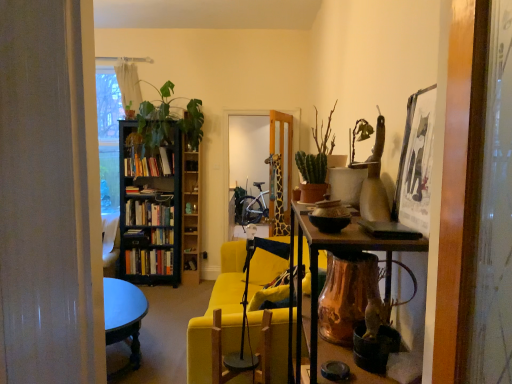
Locate an element on the screen. hardcover book at center, placed as the third book when sorted from top to bottom is located at coordinates (134, 234).

The image size is (512, 384). What do you see at coordinates (148, 213) in the screenshot? I see `hardcover books at left, which is counted as the 2th book, starting from the top` at bounding box center [148, 213].

Measure the distance between point [133,252] and camera.

The distance of point [133,252] from camera is 4.83 meters.

The height and width of the screenshot is (384, 512). Describe the element at coordinates (416, 162) in the screenshot. I see `white paper picture frame at upper right` at that location.

In order to face wooden swivel chair at center, should I rotate leftwards or rightwards?

You should rotate left by 1.893 degrees.

You are a GUI agent. You are given a task and a screenshot of the screen. Output one action in this format:
    pyautogui.click(x=<x>, y=<y>)
    Task: Click on the wooden swivel chair at center
    The height and width of the screenshot is (384, 512).
    Given the screenshot: What is the action you would take?
    pyautogui.click(x=255, y=355)

Where is `green matte cactus at center`? Image resolution: width=512 pixels, height=384 pixels. green matte cactus at center is located at coordinates (316, 163).

Describe the element at coordinates (168, 119) in the screenshot. I see `green leafy plant at left` at that location.

Measure the distance between green leafy plant at left and camera.

green leafy plant at left is 4.47 meters from camera.

At what (x,y) coordinates should I click in order to perform the action: click on hardcover book at center, placed as the third book when sorted from top to bottom. Please return your answer as a coordinate pair (x, y). Looking at the image, I should click on (134, 234).

Are hardcover books at left, which is counted as the 2th book, starting from the top, and green leafy plant at left located far from each other?

No.

From a real-world perspective, does hardcover books at left, placed as the 3th book when sorted from bottom to top, sit lower than green leafy plant at left?

Yes, from a real-world perspective, hardcover books at left, placed as the 3th book when sorted from bottom to top, is under green leafy plant at left.

Does point (145, 204) come in front of point (153, 113)?

No, it is not.

Which is more to the left, hardcover books at left, which is counted as the 2th book, starting from the top, or green leafy plant at left?

From the viewer's perspective, hardcover books at left, which is counted as the 2th book, starting from the top, appears more on the left side.

Between wooden swivel chair at center and yellow fabric couch at center, which one has larger size?

With larger size is yellow fabric couch at center.

Locate an element on the screen. chair behind the wooden swivel chair at center is located at coordinates (222, 314).

Is wooden swivel chair at center facing towards yellow fabric couch at center?

No, wooden swivel chair at center is not oriented towards yellow fabric couch at center.

Based on the photo, from a real-world perspective, is wooden swivel chair at center physically above yellow fabric couch at center?

Yes, from a real-world perspective, wooden swivel chair at center is above yellow fabric couch at center.

From a real-world perspective, between hardcover books at left, which is counted as the first book, starting from the bottom, and wooden shelf at left, who is vertically higher?

From a 3D spatial view, wooden shelf at left is above.

Where is `the 3rd book to the left when counting from the wooden shelf at left`? The width and height of the screenshot is (512, 384). the 3rd book to the left when counting from the wooden shelf at left is located at coordinates [149, 262].

Is point (138, 253) in front of point (194, 190)?

Yes.

What's the angular difference between hardcover books at left, which is counted as the first book, starting from the bottom, and wooden shelf at left's facing directions?

0.434 degrees separate the facing orientations of hardcover books at left, which is counted as the first book, starting from the bottom, and wooden shelf at left.

This screenshot has width=512, height=384. Identify the location of chair in front of the hardcover books at left, the fourth book from the bottom. (222, 314).

Considering the relative sizes of yellow fabric couch at center and hardcover books at left, which is the 1th book in top-to-bottom order, in the image provided, is yellow fabric couch at center shorter than hardcover books at left, which is the 1th book in top-to-bottom order,?

No.

Is yellow fabric couch at center not close to hardcover books at left, the fourth book from the bottom?

Indeed, yellow fabric couch at center is not near hardcover books at left, the fourth book from the bottom.

Does yellow fabric couch at center have a lesser width compared to hardcover books at left, which is the 1th book in top-to-bottom order?

No.

From a real-world perspective, who is located lower, hardcover book at center, acting as the 2th book starting from the bottom, or green matte cactus at center?

In real-world perspective, hardcover book at center, acting as the 2th book starting from the bottom, is lower.

Who is smaller, hardcover book at center, acting as the 2th book starting from the bottom, or green matte cactus at center?

With smaller size is hardcover book at center, acting as the 2th book starting from the bottom.

Is hardcover book at center, placed as the third book when sorted from top to bottom, looking in the opposite direction of green matte cactus at center?

No, green matte cactus at center is not at the back of hardcover book at center, placed as the third book when sorted from top to bottom.

From the image's perspective, would you say hardcover book at center, acting as the 2th book starting from the bottom, is positioned over green matte cactus at center?

Incorrect, from the image's perspective, hardcover book at center, acting as the 2th book starting from the bottom, is lower than green matte cactus at center.

Are hardcover books at left, positioned as the fourth book in top-to-bottom order, and hardcover books at left, which is counted as the 2th book, starting from the top, beside each other?

No, hardcover books at left, positioned as the fourth book in top-to-bottom order, is not beside hardcover books at left, which is counted as the 2th book, starting from the top.

Which of these two, hardcover books at left, which is counted as the first book, starting from the bottom, or hardcover books at left, which is counted as the 2th book, starting from the top, is bigger?

hardcover books at left, which is counted as the first book, starting from the bottom.

Does hardcover books at left, which is counted as the first book, starting from the bottom, have a lesser height compared to hardcover books at left, placed as the 3th book when sorted from bottom to top?

In fact, hardcover books at left, which is counted as the first book, starting from the bottom, may be taller than hardcover books at left, placed as the 3th book when sorted from bottom to top.

Considering the sizes of objects hardcover books at left, positioned as the fourth book in top-to-bottom order, and hardcover books at left, which is counted as the 2th book, starting from the top, in the image provided, who is thinner, hardcover books at left, positioned as the fourth book in top-to-bottom order, or hardcover books at left, which is counted as the 2th book, starting from the top,?

Thinner between the two is hardcover books at left, which is counted as the 2th book, starting from the top.

Is wooden swivel chair at center inside or outside of hardcover book at center, placed as the third book when sorted from top to bottom?

wooden swivel chair at center cannot be found inside hardcover book at center, placed as the third book when sorted from top to bottom.

Locate an element on the screen. The image size is (512, 384). swivel chair beneath the hardcover book at center, acting as the 2th book starting from the bottom (from a real-world perspective) is located at coordinates (255, 355).

Which is nearer, (221,348) or (126,234)?

Point (221,348) is positioned closer to the camera compared to point (126,234).

Looking at this image, which is more to the left, wooden swivel chair at center or hardcover book at center, acting as the 2th book starting from the bottom?

hardcover book at center, acting as the 2th book starting from the bottom.

At what (x,y) coordinates should I click in order to perform the action: click on plant on the right of hardcover books at left, placed as the 3th book when sorted from bottom to top. Please return your answer as a coordinate pair (x, y). This screenshot has height=384, width=512. Looking at the image, I should click on (168, 119).

Identify the location of chair below the wooden swivel chair at center (from a real-world perspective). This screenshot has width=512, height=384. (222, 314).

When comparing their distances from wooden shelf at left, does black wooden bookcase at left or yellow fabric couch at center seem further?

yellow fabric couch at center lies further to wooden shelf at left than the other object.

Which object lies further to the anchor point hardcover books at left, which is the 1th book in top-to-bottom order, hardcover book at center, acting as the 2th book starting from the bottom, or black wooden bookcase at left?

Based on the image, hardcover book at center, acting as the 2th book starting from the bottom, appears to be further to hardcover books at left, which is the 1th book in top-to-bottom order.

Estimate the real-world distances between objects in this image. Which object is further from black wooden bookcase at left, green matte cactus at center or hardcover books at left, positioned as the fourth book in top-to-bottom order?

green matte cactus at center lies further to black wooden bookcase at left than the other object.

Based on their spatial positions, is green matte cactus at center or yellow fabric couch at center further from green leafy plant at left?

green matte cactus at center is further to green leafy plant at left.

Based on their spatial positions, is hardcover book at center, placed as the third book when sorted from top to bottom, or wooden swivel chair at center further from hardcover books at left, which is the 1th book in top-to-bottom order?

wooden swivel chair at center is further to hardcover books at left, which is the 1th book in top-to-bottom order.

Which object lies nearer to the anchor point green matte cactus at center, yellow fabric couch at center or hardcover books at left, placed as the 3th book when sorted from bottom to top?

Among the two, yellow fabric couch at center is located nearer to green matte cactus at center.

Based on their spatial positions, is white paper picture frame at upper right or black wooden bookcase at left further from green leafy plant at left?

The object further to green leafy plant at left is white paper picture frame at upper right.

From the image, which object appears to be nearer to green matte cactus at center, wooden shelf at left or green leafy plant at left?

The object closer to green matte cactus at center is green leafy plant at left.

Find the location of `picture frame between green matte cactus at center and wooden swivel chair at center vertically`. picture frame between green matte cactus at center and wooden swivel chair at center vertically is located at coordinates (x=416, y=162).

The width and height of the screenshot is (512, 384). In order to click on bookcase between wooden shelf at left and hardcover books at left, positioned as the fourth book in top-to-bottom order, in the up-down direction in this screenshot , I will do `click(150, 206)`.

Where is `bookcase between wooden swivel chair at center and wooden shelf at left from front to back`? bookcase between wooden swivel chair at center and wooden shelf at left from front to back is located at coordinates (150, 206).

This screenshot has width=512, height=384. Identify the location of houseplant positioned between white paper picture frame at upper right and green leafy plant at left from near to far. [x=316, y=163].